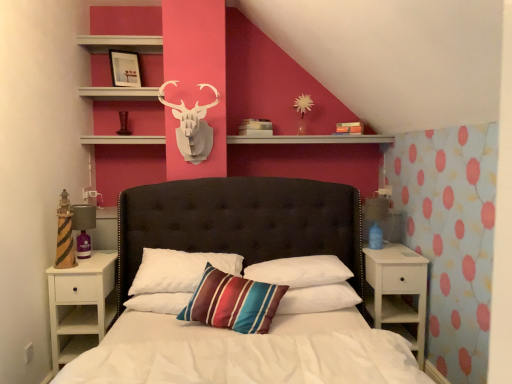
Question: Considering the relative sizes of white soft pillow at center, positioned as the 3th pillow in left-to-right order, and white matte shelf at upper center in the image provided, is white soft pillow at center, positioned as the 3th pillow in left-to-right order, thinner than white matte shelf at upper center?

Choices:
 (A) yes
 (B) no

Answer: (B)

Question: From the image's perspective, is white soft pillow at center, positioned as the 3th pillow in left-to-right order, on white matte shelf at upper center?

Choices:
 (A) no
 (B) yes

Answer: (A)

Question: From the image's perspective, does white soft pillow at center, positioned as the 3th pillow in left-to-right order, appear lower than white matte shelf at upper center?

Choices:
 (A) yes
 (B) no

Answer: (A)

Question: Would you say white matte shelf at upper center is part of white soft pillow at center, which is the second pillow from right to left,'s contents?

Choices:
 (A) yes
 (B) no

Answer: (B)

Question: Is white soft pillow at center, positioned as the 3th pillow in left-to-right order, far away from white matte shelf at upper center?

Choices:
 (A) yes
 (B) no

Answer: (A)

Question: Can we say white soft pillow at center, positioned as the 3th pillow in left-to-right order, lies outside white matte shelf at upper center?

Choices:
 (A) no
 (B) yes

Answer: (B)

Question: Is white soft pillow at center, which is the second pillow from right to left, at the back of white matte shelf at upper center?

Choices:
 (A) no
 (B) yes

Answer: (A)

Question: Would you say white soft pillow at center, positioned as the 3th pillow in left-to-right order, is part of white matte shelf at upper center's contents?

Choices:
 (A) yes
 (B) no

Answer: (B)

Question: Is the surface of white matte shelf at upper center in direct contact with white soft pillow at center, positioned as the 3th pillow in left-to-right order?

Choices:
 (A) no
 (B) yes

Answer: (A)

Question: From a real-world perspective, is white matte shelf at upper center located higher than white soft pillow at center, positioned as the 3th pillow in left-to-right order?

Choices:
 (A) yes
 (B) no

Answer: (A)

Question: Can you confirm if white matte shelf at upper center is shorter than white soft pillow at center, positioned as the 3th pillow in left-to-right order?

Choices:
 (A) no
 (B) yes

Answer: (B)

Question: Is white matte shelf at upper center far from white soft pillow at center, which is the second pillow from right to left?

Choices:
 (A) no
 (B) yes

Answer: (B)

Question: Is matte black picture frame at upper center completely or partially outside of striped fabric pillow at center, positioned as the third pillow in right-to-left order?

Choices:
 (A) no
 (B) yes

Answer: (B)